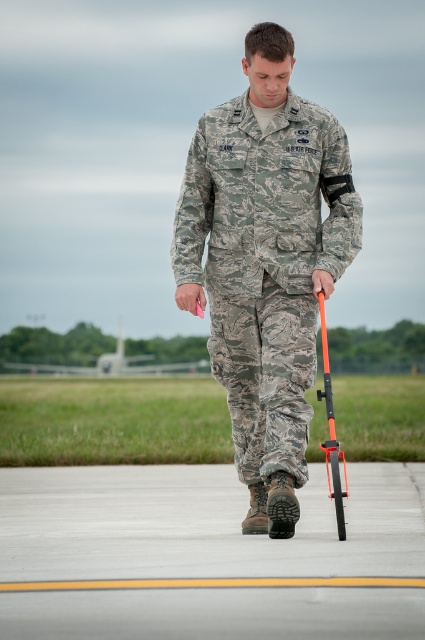
Question: Is camouflage fabric uniform at center above orange matte crutch at center?

Choices:
 (A) no
 (B) yes

Answer: (B)

Question: Can you confirm if gray concrete tarmac at center is thinner than camouflage fabric uniform at center?

Choices:
 (A) no
 (B) yes

Answer: (B)

Question: Among these points, which one is nearest to the camera?

Choices:
 (A) (217, 339)
 (B) (376, 557)
 (C) (345, 483)

Answer: (B)

Question: Among these objects, which one is nearest to the camera?

Choices:
 (A) gray concrete tarmac at center
 (B) orange matte crutch at center

Answer: (B)

Question: Which point is farther to the camera?

Choices:
 (A) (251, 333)
 (B) (334, 452)
 (C) (164, 554)

Answer: (A)

Question: Is gray concrete tarmac at center thinner than camouflage fabric uniform at center?

Choices:
 (A) no
 (B) yes

Answer: (B)